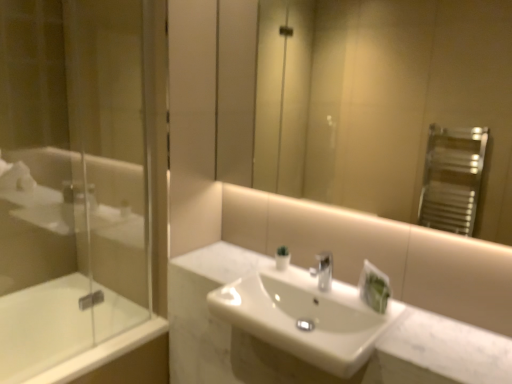
What do you see at coordinates (304, 318) in the screenshot?
I see `white glossy sink at center` at bounding box center [304, 318].

Find the location of `transparent glass shower door at left`. transparent glass shower door at left is located at coordinates coord(70,179).

Can you confirm if matte glass mirror at upper center is taller than transparent glass shower door at left?

Incorrect, the height of matte glass mirror at upper center is not larger of that of transparent glass shower door at left.

From the picture: Based on their sizes in the image, would you say matte glass mirror at upper center is bigger or smaller than transparent glass shower door at left?

Clearly, matte glass mirror at upper center is smaller in size than transparent glass shower door at left.

Which object is thinner, matte glass mirror at upper center or transparent glass shower door at left?

matte glass mirror at upper center.

Is matte glass mirror at upper center positioned with its back to transparent glass shower door at left?

That's not correct — matte glass mirror at upper center is not looking away from transparent glass shower door at left.

Who is bigger, matte glass mirror at upper center or white glossy bathtub at lower left?

Bigger between the two is white glossy bathtub at lower left.

Is matte glass mirror at upper center inside the boundaries of white glossy bathtub at lower left, or outside?

matte glass mirror at upper center is located beyond the bounds of white glossy bathtub at lower left.

Is point (367, 138) positioned before point (38, 348)?

No, (367, 138) is behind (38, 348).

Based on the photo, based on their positions, is matte glass mirror at upper center located to the left or right of white glossy bathtub at lower left?

matte glass mirror at upper center is to the right of white glossy bathtub at lower left.

Is white glossy sink at center touching transparent glass shower door at left?

white glossy sink at center and transparent glass shower door at left are not in contact.

Does white glossy sink at center have a larger size compared to transparent glass shower door at left?

Incorrect, white glossy sink at center is not larger than transparent glass shower door at left.

Which of these two, white glossy sink at center or transparent glass shower door at left, stands shorter?

white glossy sink at center is shorter.

Which object is positioned more to the right, white glossy sink at center or transparent glass shower door at left?

From the viewer's perspective, white glossy sink at center appears more on the right side.

Is white glossy sink at center to the left or to the right of matte glass mirror at upper center in the image?

white glossy sink at center is to the left of matte glass mirror at upper center.

Looking at this image, which of these two, white glossy sink at center or matte glass mirror at upper center, is thinner?

matte glass mirror at upper center.

Is white glossy sink at center aimed at matte glass mirror at upper center?

No, white glossy sink at center is not oriented towards matte glass mirror at upper center.

Does white glossy sink at center lie in front of matte glass mirror at upper center?

No.

The image size is (512, 384). Identify the location of sink lying above the white glossy bathtub at lower left (from the image's perspective). (304, 318).

Looking at this image, from the image's perspective, is white glossy sink at center positioned above or below white glossy bathtub at lower left?

Clearly, from the image's perspective, white glossy sink at center is above white glossy bathtub at lower left.

Are white glossy sink at center and white glossy bathtub at lower left beside each other?

There is a gap between white glossy sink at center and white glossy bathtub at lower left.

Considering the sizes of objects matte glass mirror at upper center and white glossy sink at center in the image provided, who is smaller, matte glass mirror at upper center or white glossy sink at center?

matte glass mirror at upper center is smaller.

Considering the positions of objects matte glass mirror at upper center and white glossy sink at center in the image provided, who is more to the right, matte glass mirror at upper center or white glossy sink at center?

Positioned to the right is matte glass mirror at upper center.

How different are the orientations of matte glass mirror at upper center and white glossy sink at center in degrees?

There is a 0.282-degree angle between the facing directions of matte glass mirror at upper center and white glossy sink at center.

Which object is wider, matte glass mirror at upper center or white glossy sink at center?

With larger width is white glossy sink at center.

Is transparent glass shower door at left outside of matte glass mirror at upper center?

transparent glass shower door at left is positioned outside matte glass mirror at upper center.

From the picture: From the image's perspective, would you say transparent glass shower door at left is shown under matte glass mirror at upper center?

Yes, from the image's perspective, transparent glass shower door at left is beneath matte glass mirror at upper center.

From their relative heights in the image, would you say transparent glass shower door at left is taller or shorter than matte glass mirror at upper center?

Clearly, transparent glass shower door at left is taller compared to matte glass mirror at upper center.

Considering the points (122, 257) and (486, 160), which point is behind, point (122, 257) or point (486, 160)?

The point (486, 160) is more distant.

The width and height of the screenshot is (512, 384). What are the coordinates of `mirror that is on the right side of transparent glass shower door at left` in the screenshot? It's located at (364, 99).

Find the location of `mirror that appears above the white glossy bathtub at lower left (from a real-world perspective)`. mirror that appears above the white glossy bathtub at lower left (from a real-world perspective) is located at coordinates (364, 99).

From the image, which object appears to be farther from white glossy bathtub at lower left, white glossy sink at center or matte glass mirror at upper center?

matte glass mirror at upper center is positioned further to the anchor white glossy bathtub at lower left.

When comparing their distances from transparent glass shower door at left, does white glossy sink at center or matte glass mirror at upper center seem closer?

white glossy sink at center is positioned closer to the anchor transparent glass shower door at left.

Considering their positions, is transparent glass shower door at left positioned further to white glossy sink at center than matte glass mirror at upper center?

The object further to white glossy sink at center is matte glass mirror at upper center.

When comparing their distances from transparent glass shower door at left, does white glossy bathtub at lower left or matte glass mirror at upper center seem closer?

white glossy bathtub at lower left.

From the image, which object appears to be nearer to white glossy bathtub at lower left, matte glass mirror at upper center or transparent glass shower door at left?

transparent glass shower door at left is positioned closer to the anchor white glossy bathtub at lower left.

Which object lies further to the anchor point transparent glass shower door at left, white glossy bathtub at lower left or white glossy sink at center?

white glossy sink at center.

Which object lies further to the anchor point matte glass mirror at upper center, transparent glass shower door at left or white glossy sink at center?

Based on the image, transparent glass shower door at left appears to be further to matte glass mirror at upper center.

Which object lies nearer to the anchor point matte glass mirror at upper center, white glossy bathtub at lower left or white glossy sink at center?

white glossy sink at center lies closer to matte glass mirror at upper center than the other object.

Locate an element on the screen. sink situated between transparent glass shower door at left and matte glass mirror at upper center from left to right is located at coordinates (304, 318).

Identify the location of sink situated between white glossy bathtub at lower left and matte glass mirror at upper center from left to right. (304, 318).

This screenshot has height=384, width=512. I want to click on shower door situated between white glossy bathtub at lower left and white glossy sink at center from left to right, so [x=70, y=179].

This screenshot has width=512, height=384. I want to click on shower door situated between white glossy bathtub at lower left and matte glass mirror at upper center from left to right, so click(70, 179).